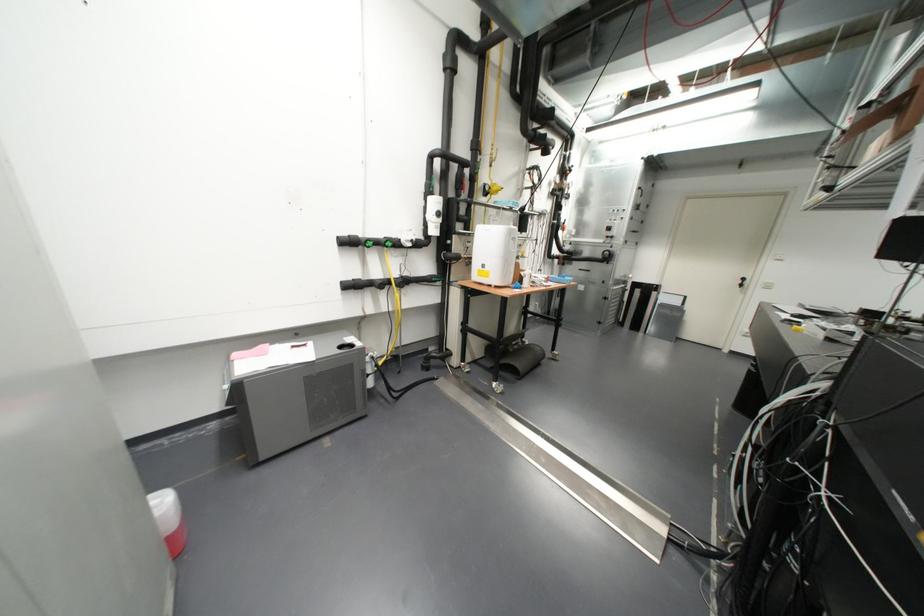
I want to click on red and white bucket, so pyautogui.click(x=168, y=519).